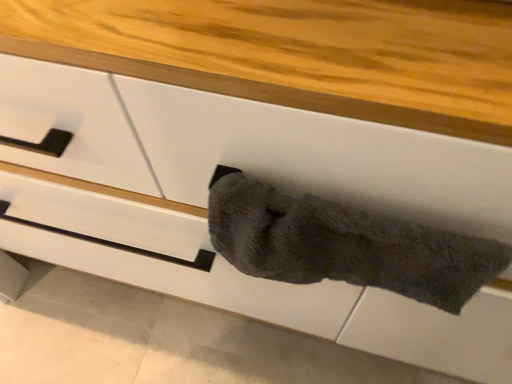
What do you see at coordinates (345, 244) in the screenshot? The height and width of the screenshot is (384, 512). I see `dark gray fluffy towel at center` at bounding box center [345, 244].

Find the location of a particular element. The height and width of the screenshot is (384, 512). dark gray fluffy towel at center is located at coordinates (345, 244).

Identify the location of dark gray fluffy towel at center. (345, 244).